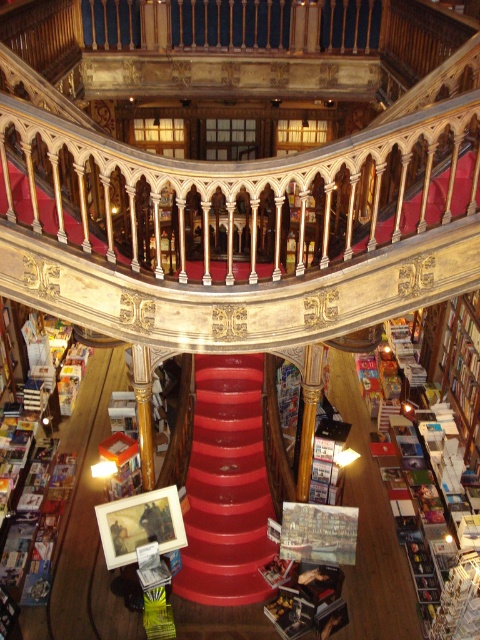
Question: Which of the following is the closest to the observer?

Choices:
 (A) (284, 637)
 (B) (237, 422)

Answer: (A)

Question: Which object appears closest to the camera in this image?

Choices:
 (A) hardcover book at center
 (B) smooth red staircase at center

Answer: (A)

Question: Is smooth red staircase at center further to the viewer compared to hardcover book at center?

Choices:
 (A) yes
 (B) no

Answer: (A)

Question: Can you confirm if smooth red staircase at center is smaller than hardcover book at center?

Choices:
 (A) yes
 (B) no

Answer: (B)

Question: Is smooth red staircase at center to the left of hardcover book at center from the viewer's perspective?

Choices:
 (A) yes
 (B) no

Answer: (A)

Question: Which object appears farthest from the camera in this image?

Choices:
 (A) hardcover book at center
 (B) smooth red staircase at center

Answer: (B)